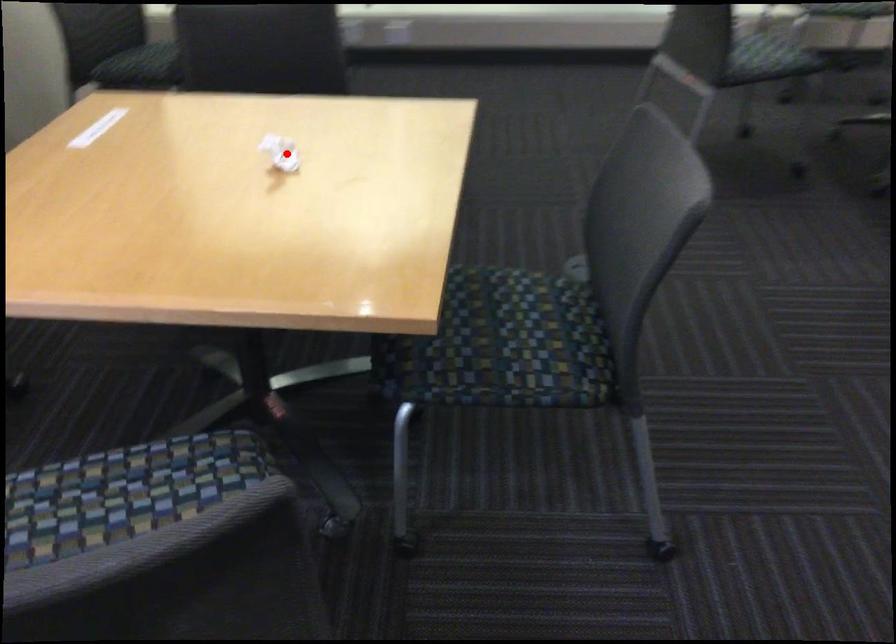
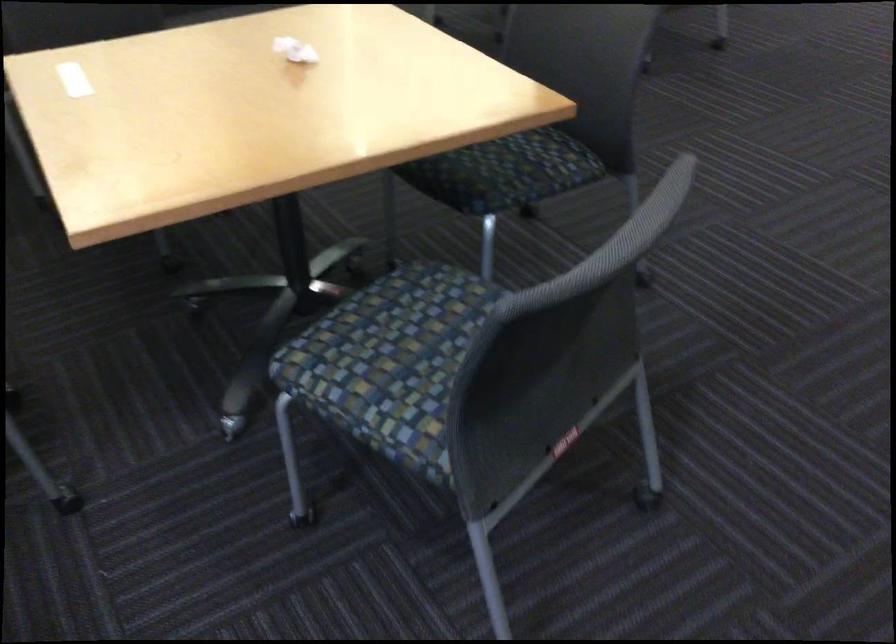
Question: I am providing you with two images of the same scene from different viewpoints. A red point is marked on the first image. Can you still see the location of the red point in image 2?

Choices:
 (A) Yes
 (B) No

Answer: (A)